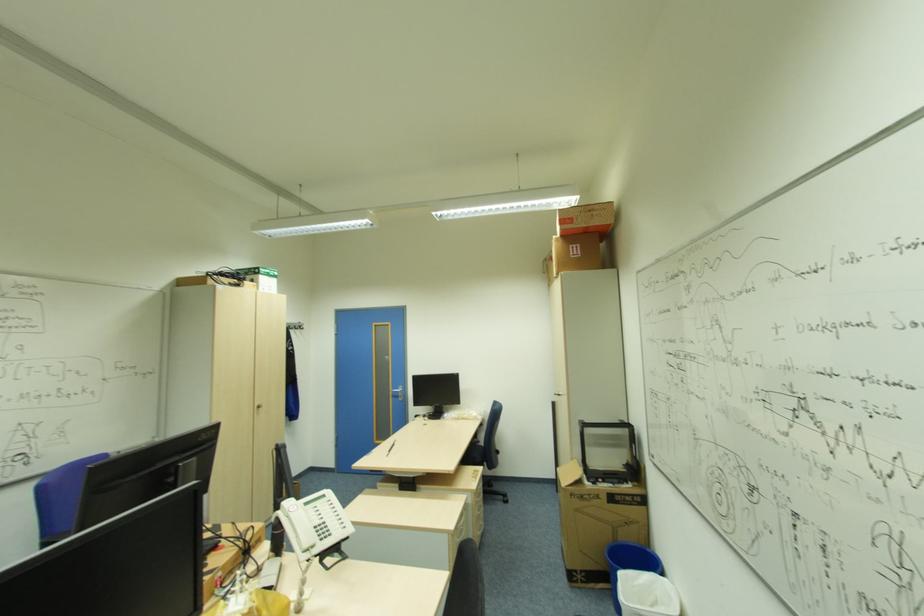
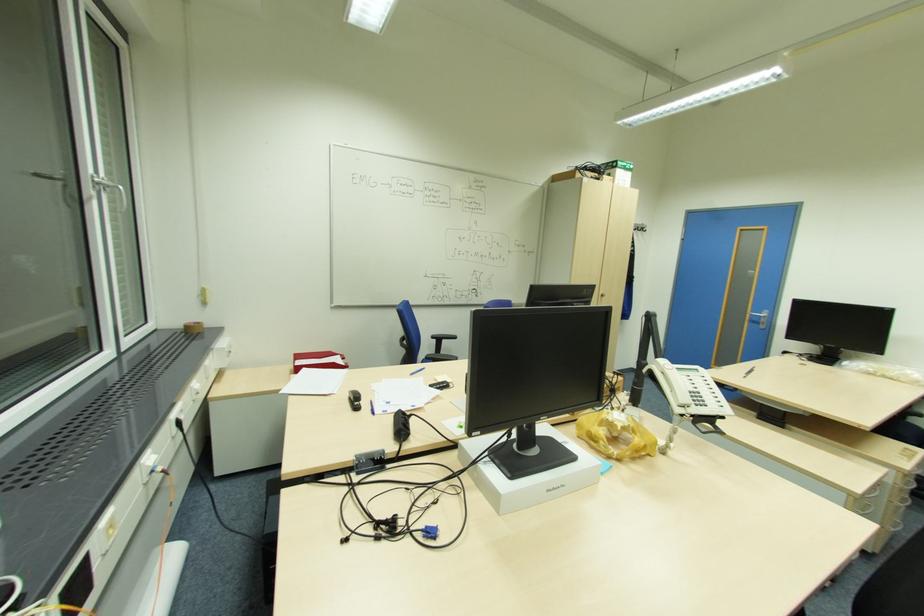
The point at (261, 407) is marked in the first image. Where is the corresponding point in the second image?

(604, 294)